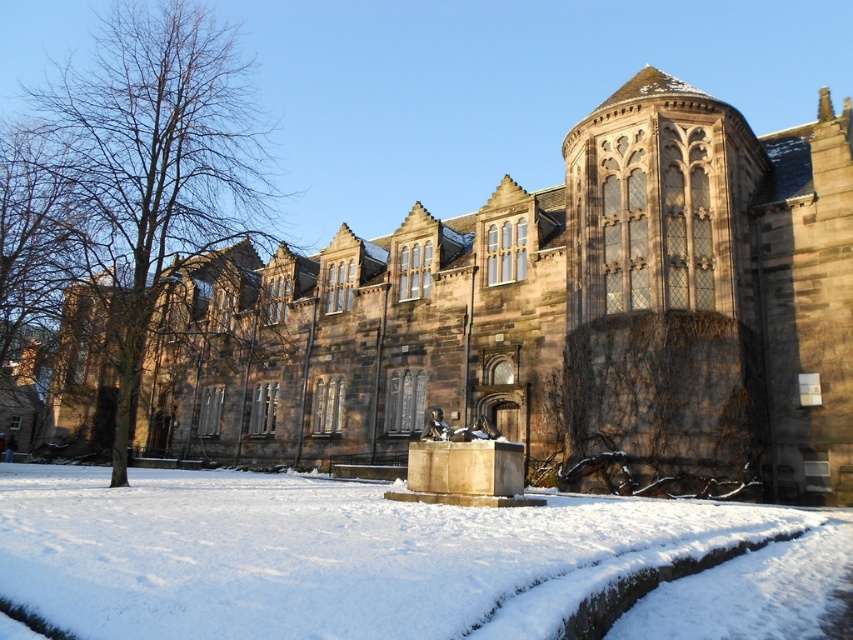
Does brown stone church at center appear on the left side of white powdery snow at center?

In fact, brown stone church at center is to the right of white powdery snow at center.

Can you confirm if brown stone church at center is taller than white powdery snow at center?

Correct, brown stone church at center is much taller as white powdery snow at center.

Between point (331, 422) and point (734, 525), which one is positioned behind?

The point (331, 422) is more distant.

Image resolution: width=853 pixels, height=640 pixels. What are the coordinates of `brown stone church at center` in the screenshot? It's located at (550, 316).

Between brown stone church at center and brown bark tree at left, which one is positioned lower?

brown stone church at center is lower down.

Is brown stone church at center behind brown bark tree at left?

No, it is in front of brown bark tree at left.

Describe the element at coordinates (550, 316) in the screenshot. I see `brown stone church at center` at that location.

Locate an element on the screen. The image size is (853, 640). brown stone church at center is located at coordinates (550, 316).

Is white powdery snow at center thinner than brown bark tree at left?

Yes.

Is point (51, 502) closer to camera compared to point (186, 29)?

Yes, it is.

Locate an element on the screen. The image size is (853, 640). white powdery snow at center is located at coordinates [386, 560].

Where is `white powdery snow at center`? The height and width of the screenshot is (640, 853). white powdery snow at center is located at coordinates (386, 560).